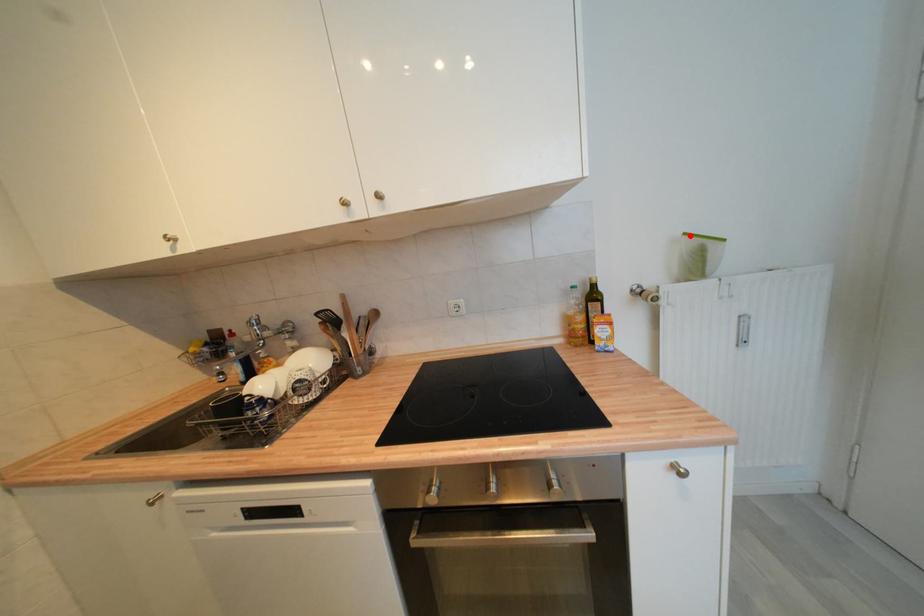
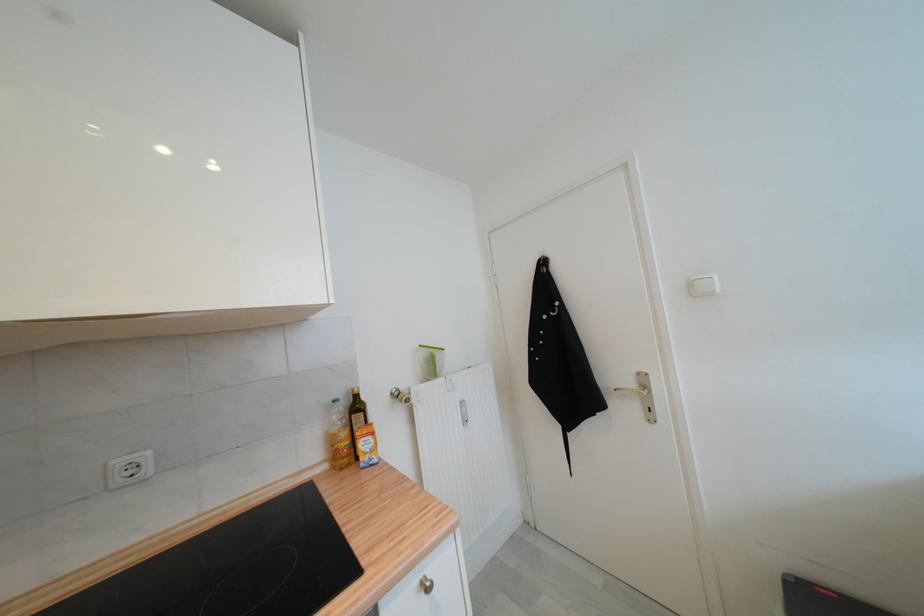
The point at the highlighted location is marked in the first image. Where is the corresponding point in the second image?

(426, 347)